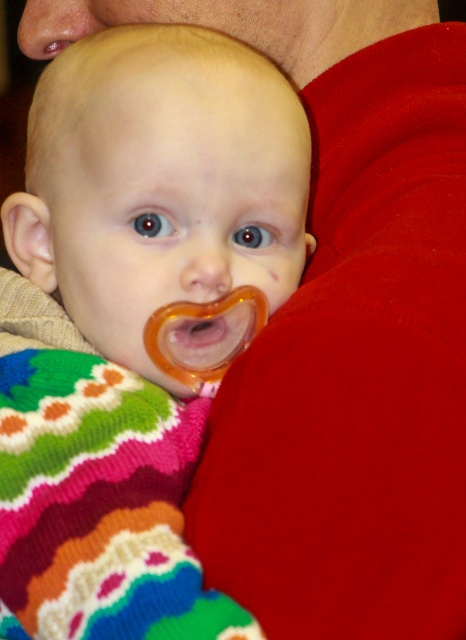
Question: Among these objects, which one is nearest to the camera?

Choices:
 (A) smooth skin nose at upper left
 (B) matte plastic pacifier at center
 (C) translucent orange pacifier at center

Answer: (B)

Question: Can you confirm if smooth flesh nose at center is bigger than translucent orange pacifier at center?

Choices:
 (A) no
 (B) yes

Answer: (A)

Question: Is smooth skin nose at upper left to the left of smooth flesh nose at center from the viewer's perspective?

Choices:
 (A) yes
 (B) no

Answer: (A)

Question: Which of the following is the farthest from the observer?

Choices:
 (A) smooth flesh nose at center
 (B) translucent orange pacifier at center

Answer: (B)

Question: Among these objects, which one is farthest from the camera?

Choices:
 (A) smooth flesh nose at center
 (B) translucent orange pacifier at center
 (C) matte plastic pacifier at center

Answer: (B)

Question: Can you confirm if smooth skin nose at upper left is positioned to the right of translucent orange pacifier at center?

Choices:
 (A) yes
 (B) no

Answer: (B)